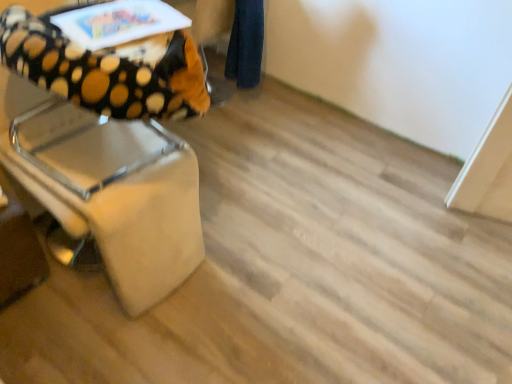
What are the coordinates of `vacant region to the right of beige leather chair at left` in the screenshot? It's located at (227, 266).